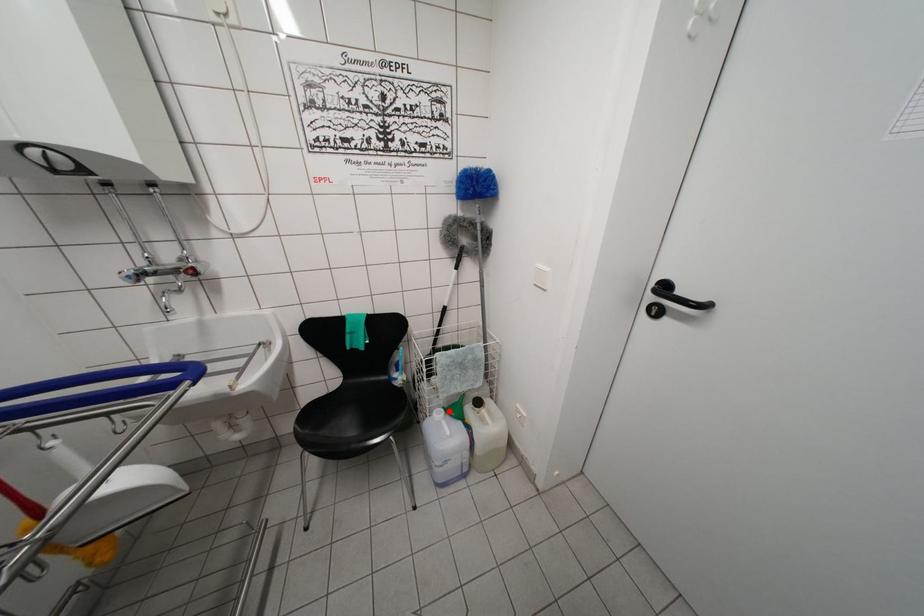
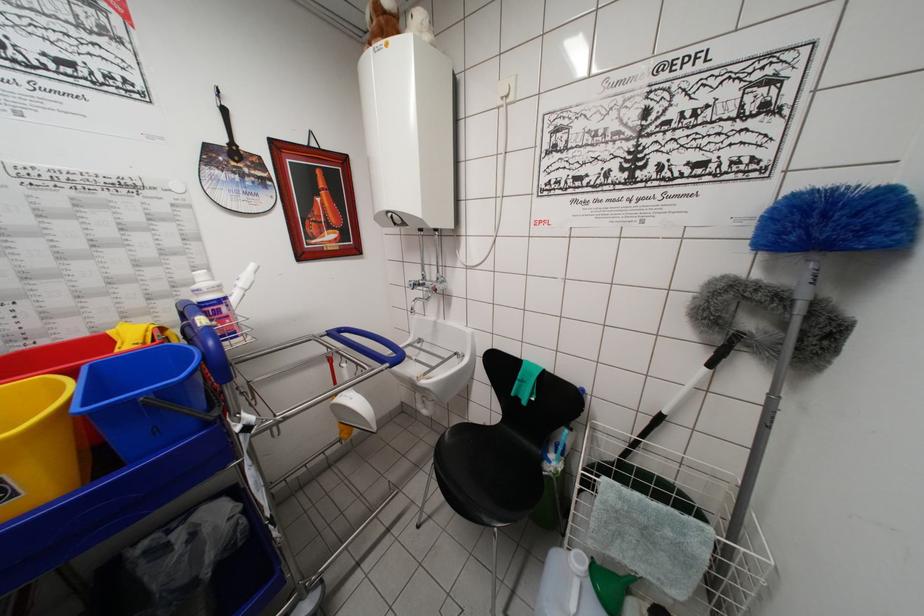
Question: I am providing you with two images of the same scene from different viewpoints. A red point is marked on the first image. Can you still see the location of the red point in image 2?

Choices:
 (A) Yes
 (B) No

Answer: (A)